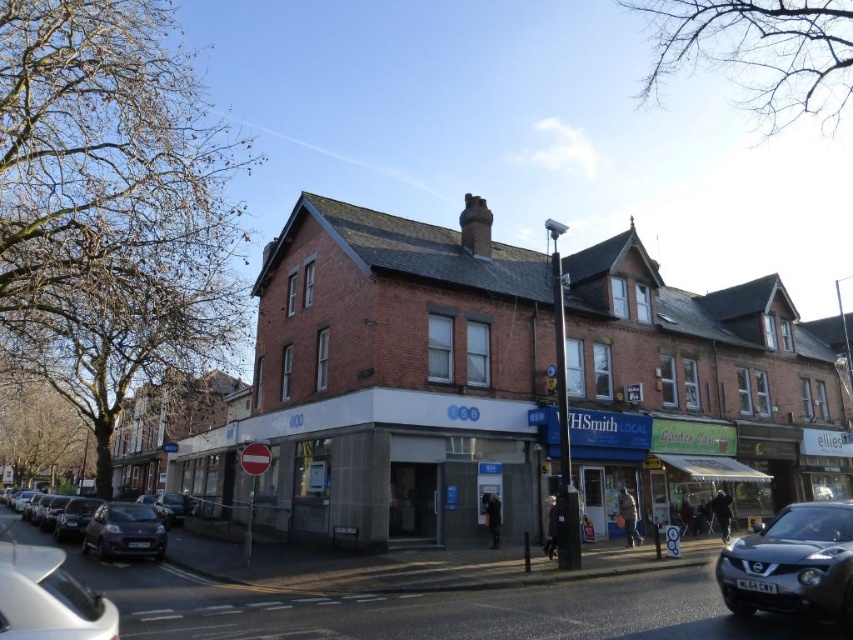
Can you confirm if dark gray metallic car at lower left is thinner than shiny dark gray car at lower left?

No.

Is dark gray metallic car at lower left positioned at the back of shiny dark gray car at lower left?

No, dark gray metallic car at lower left is in front of shiny dark gray car at lower left.

Does point (136, 520) lie in front of point (160, 524)?

Yes, point (136, 520) is closer to viewer.

The image size is (853, 640). I want to click on dark gray metallic car at lower left, so click(111, 528).

Is satin black suv at lower right above white glossy car at lower left?

Incorrect, satin black suv at lower right is not positioned above white glossy car at lower left.

What do you see at coordinates (792, 563) in the screenshot?
I see `satin black suv at lower right` at bounding box center [792, 563].

The height and width of the screenshot is (640, 853). I want to click on satin black suv at lower right, so click(x=792, y=563).

Is satin black suv at lower right to the right of dark gray metallic car at lower left from the viewer's perspective?

Correct, you'll find satin black suv at lower right to the right of dark gray metallic car at lower left.

Can you confirm if satin black suv at lower right is thinner than dark gray metallic car at lower left?

Correct, satin black suv at lower right's width is less than dark gray metallic car at lower left's.

Identify the location of satin black suv at lower right. Image resolution: width=853 pixels, height=640 pixels. pyautogui.click(x=792, y=563).

Identify the location of satin black suv at lower right. The image size is (853, 640). (792, 563).